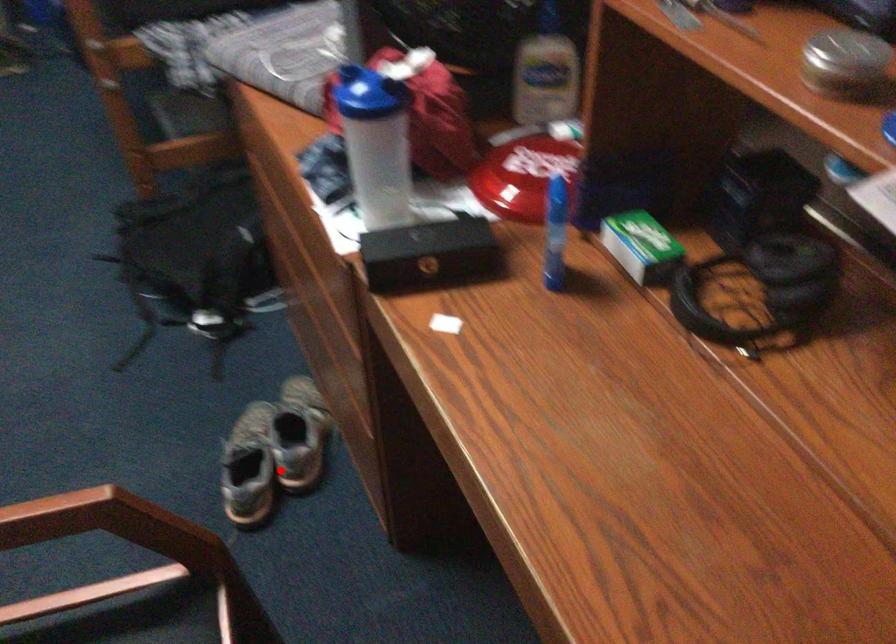
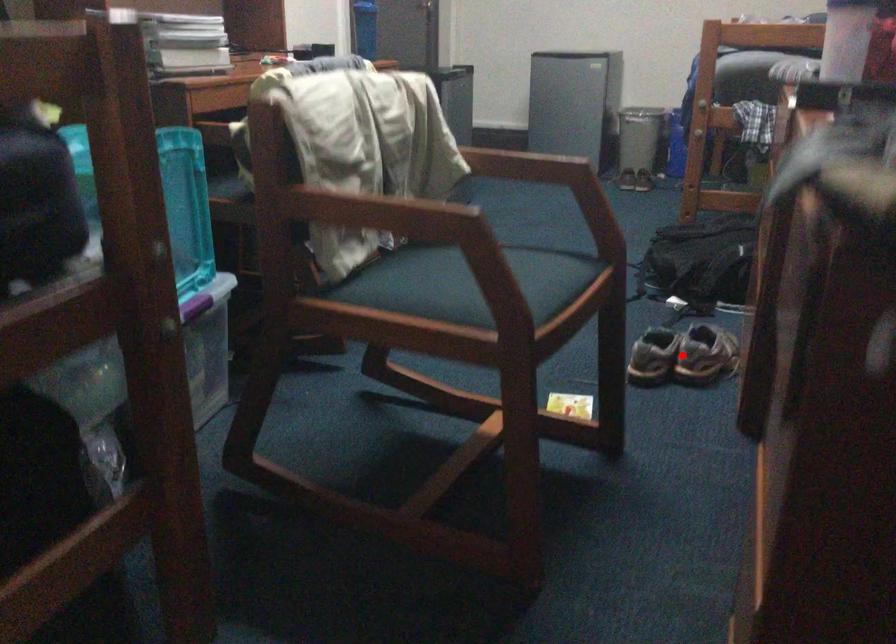
I am providing you with two images of the same scene from different viewpoints. A red point is marked on the first image and another point is marked on the second image. Is the red point in image1 aligned with the point shown in image2?

Yes